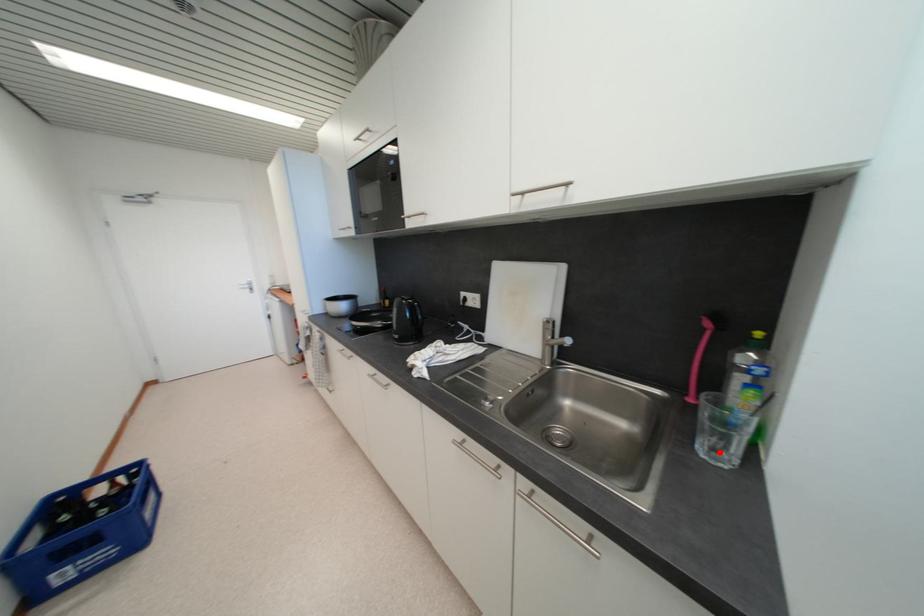
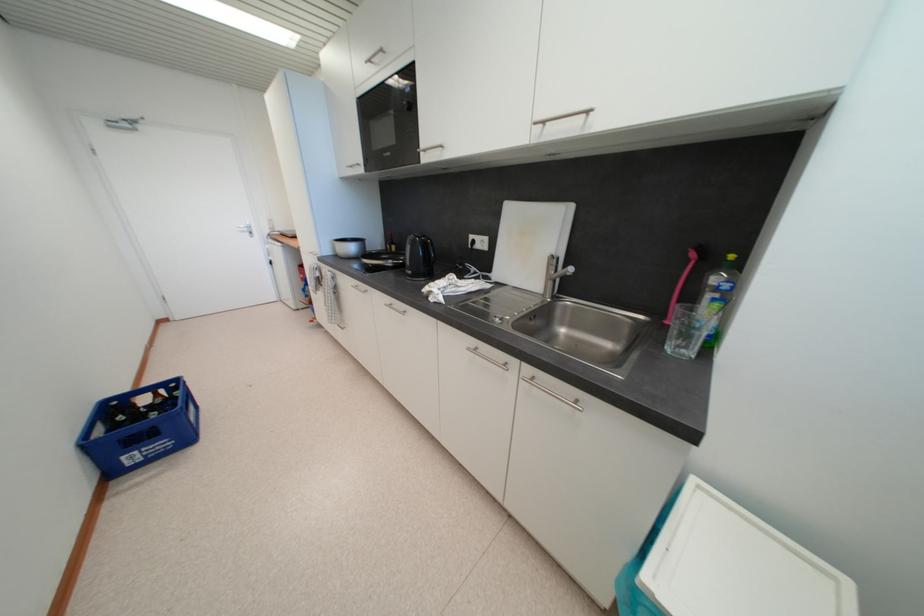
Find the pixel in the second image that matches the highlighted location in the first image.

(685, 349)